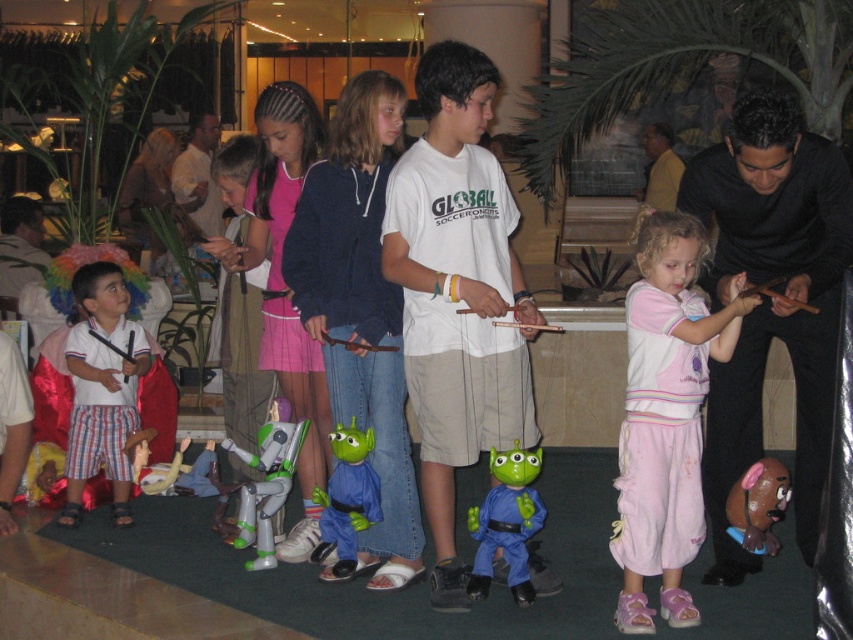
You are a child standing at the entrance of the room. You want to reach the green rubber alien at center to play with it. Which direction should you walk to get there?

The green rubber alien at center is located at point coordinates, so you should walk towards the center of the room to reach it.

You are a photographer at the event and need to position yourself so that the metallic silver robot at lower left is to the left of the pink cotton pants at center in the photo. Is this possible based on their current positions?

Yes, since the pink cotton pants at center is already to the right of the metallic silver robot at lower left, positioning yourself appropriately would allow the metallic silver robot at lower left to appear to the left of the pink cotton pants at center in the photo.